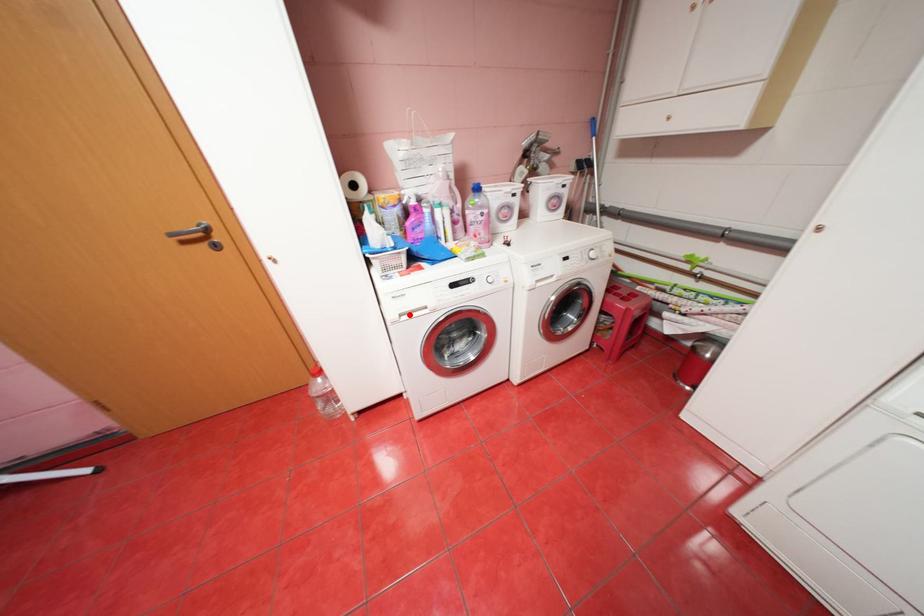
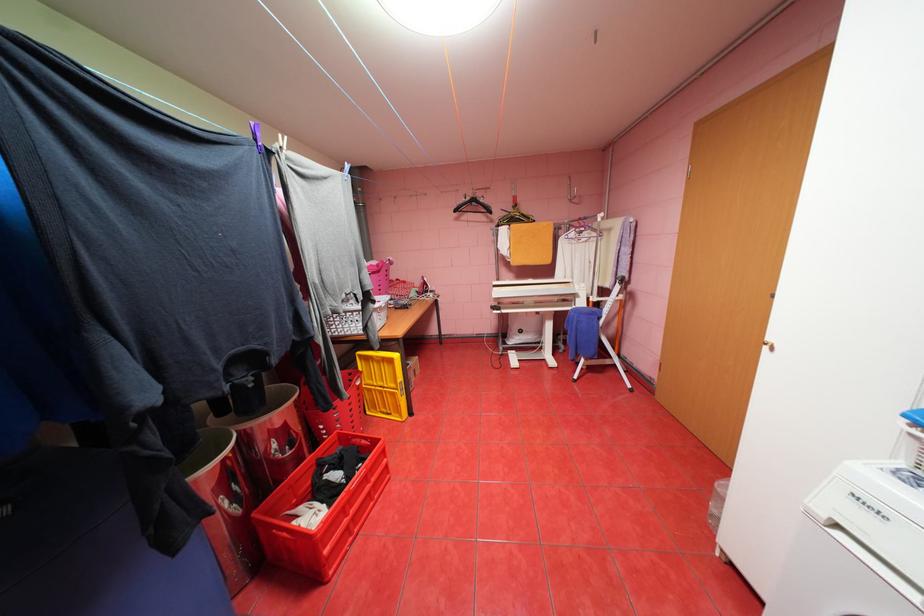
Find the pixel in the second image that matches the highlighted location in the first image.

(845, 525)